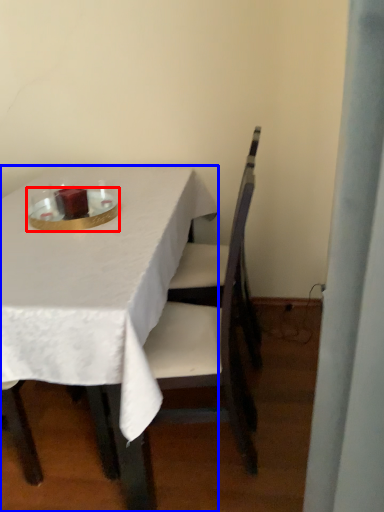
Question: Which object is further to the camera taking this photo, tableware (highlighted by a red box) or table (highlighted by a blue box)?

Choices:
 (A) tableware
 (B) table

Answer: (A)